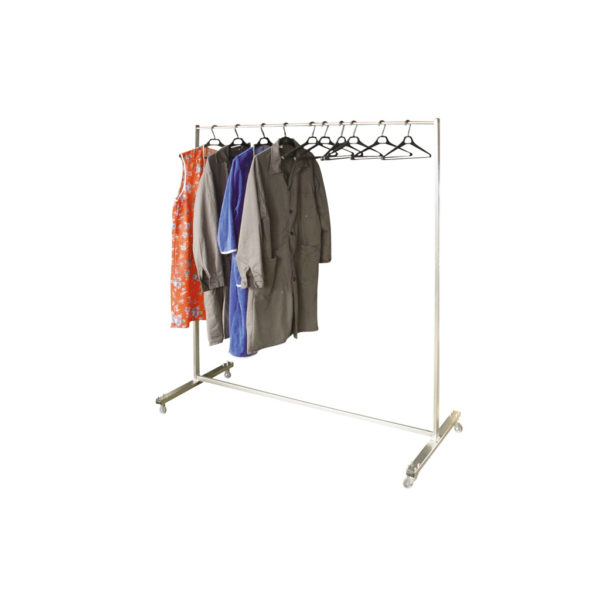
Where is `hangers`? hangers is located at coordinates (208, 141), (233, 135), (258, 139), (286, 135), (316, 128), (327, 127), (339, 128), (351, 130), (379, 133), (409, 134).